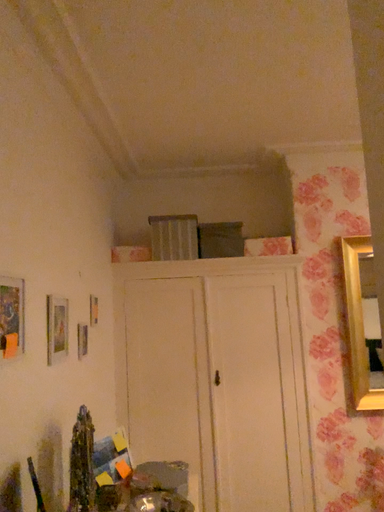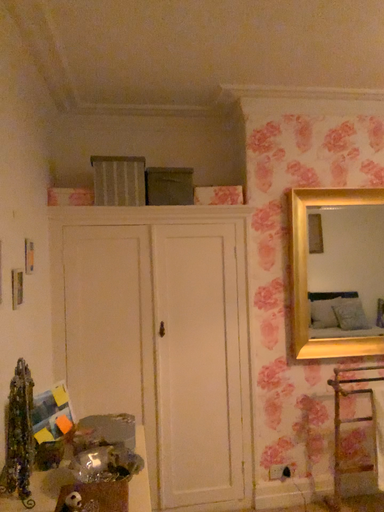
Question: Which way did the camera rotate in the video?

Choices:
 (A) rotated left
 (B) rotated right

Answer: (B)